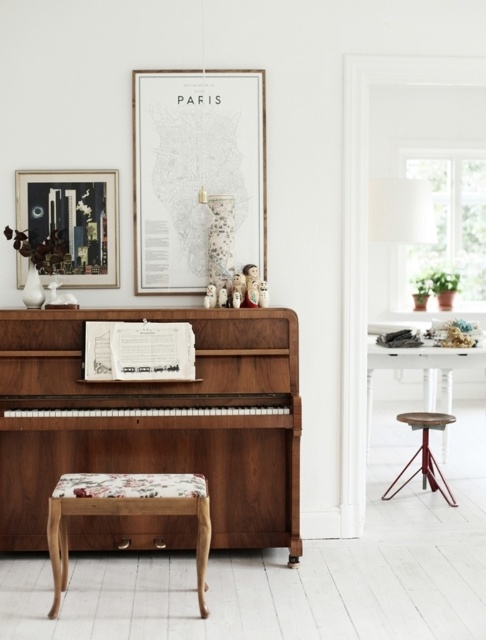
Question: Can you confirm if wooden picture frame at upper center is positioned above wooden round stool at right?

Choices:
 (A) yes
 (B) no

Answer: (A)

Question: Does floral fabric stool at lower center appear over wooden round stool at right?

Choices:
 (A) yes
 (B) no

Answer: (B)

Question: Considering the real-world distances, which object is closest to the wooden picture frame at upper center?

Choices:
 (A) shiny walnut piano at center
 (B) wooden round stool at right

Answer: (A)

Question: Which point appears farthest from the camera in this image?

Choices:
 (A) (107, 488)
 (B) (187, 152)
 (C) (48, 192)

Answer: (C)

Question: Which of these objects is positioned closest to the floral fabric stool at lower center?

Choices:
 (A) shiny walnut piano at center
 (B) matte black picture frame at upper left
 (C) wooden picture frame at upper center
 (D) wooden round stool at right

Answer: (A)

Question: Is the position of wooden picture frame at upper center less distant than that of floral fabric stool at lower center?

Choices:
 (A) no
 (B) yes

Answer: (A)